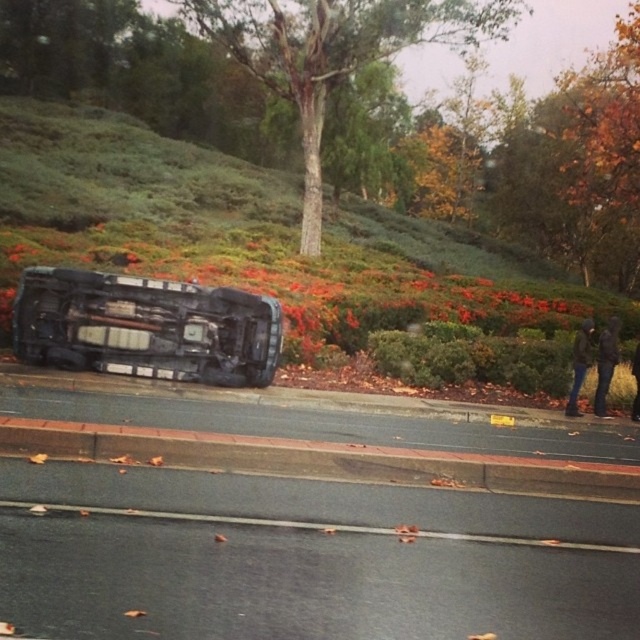
Who is more distant from viewer, (216, 26) or (346, 408)?

Positioned behind is point (216, 26).

Can you confirm if smooth bark tree at center is shorter than concrete at lower center?

In fact, smooth bark tree at center may be taller than concrete at lower center.

The width and height of the screenshot is (640, 640). Identify the location of smooth bark tree at center. (336, 52).

Does metallic silver car at center have a greater width compared to smooth bark tree at center?

Incorrect, metallic silver car at center's width does not surpass smooth bark tree at center's.

Is point (246, 305) farther from viewer compared to point (316, 204)?

No.

Identify the location of metallic silver car at center. The image size is (640, 640). (145, 326).

How far apart are smooth bark tree at center and brick-red concrete curb at lower center?

A distance of 25.08 meters exists between smooth bark tree at center and brick-red concrete curb at lower center.

Does point (436, 1) come behind point (268, 452)?

Yes.

Image resolution: width=640 pixels, height=640 pixels. Find the location of `smooth bark tree at center`. smooth bark tree at center is located at coordinates (336, 52).